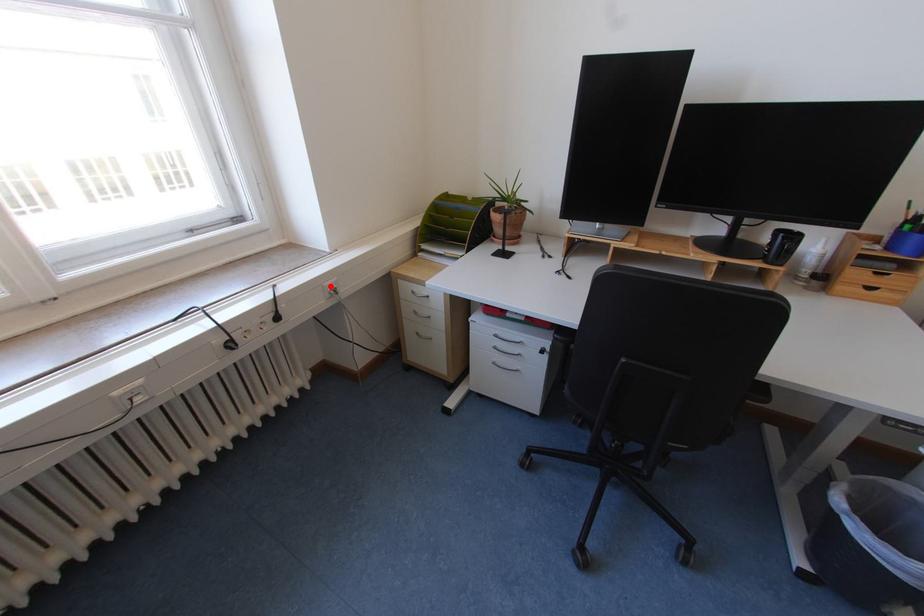
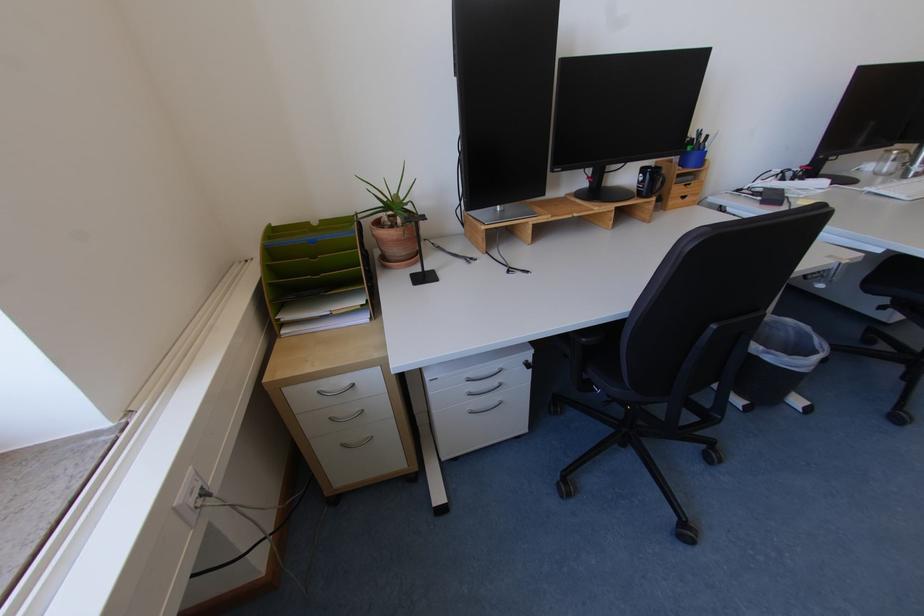
The point at the highlighted location is marked in the first image. Where is the corresponding point in the second image?

(181, 509)